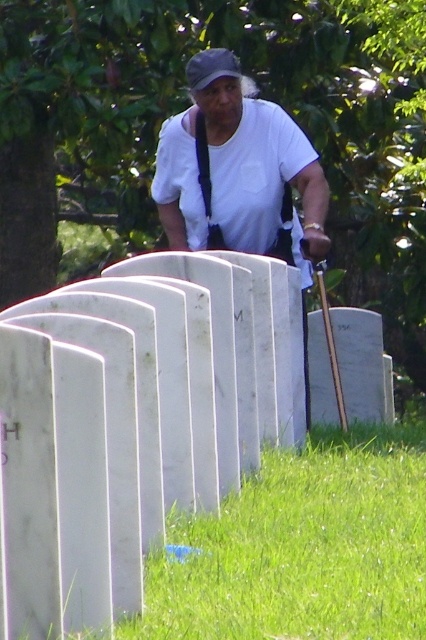
You are a visitor at a cemetery and notice the white marble gravestones at center and the black fabric suspenders at upper center. Which object is located to the left of the other?

The white marble gravestones at center is positioned on the left side of black fabric suspenders at upper center.

You are a tour guide explaining the cemetery layout to visitors. You point to the white marble gravestones at center and the black fabric suspenders at upper center. Which object is larger in size?

The white marble gravestones at center are larger than the black fabric suspenders at upper center.